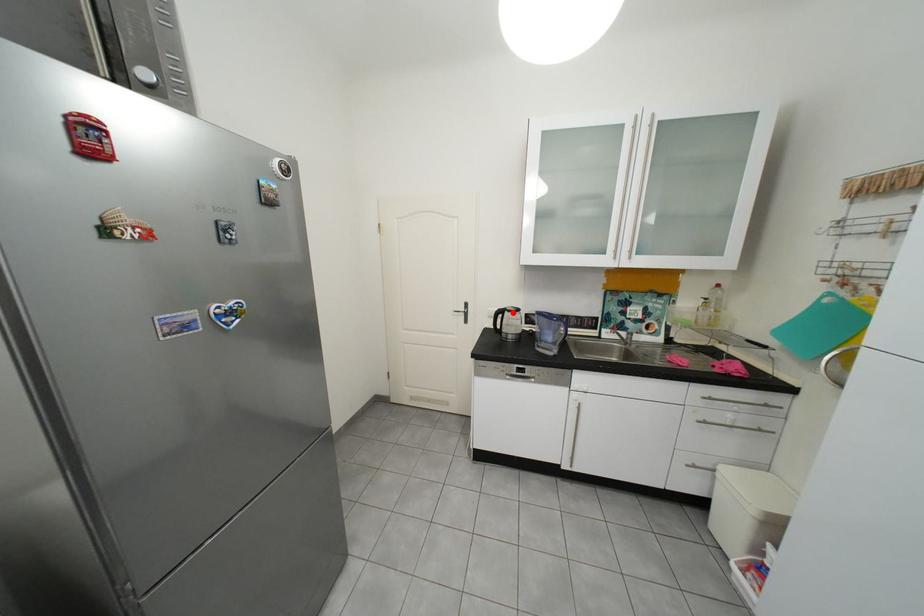
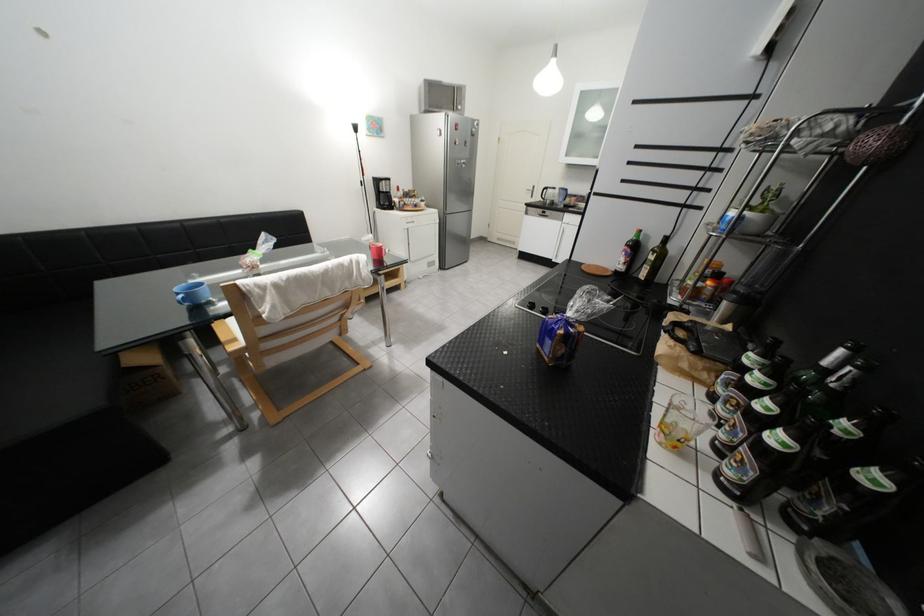
Locate, in the second image, the point that corresponds to the highlighted location in the first image.

(557, 190)